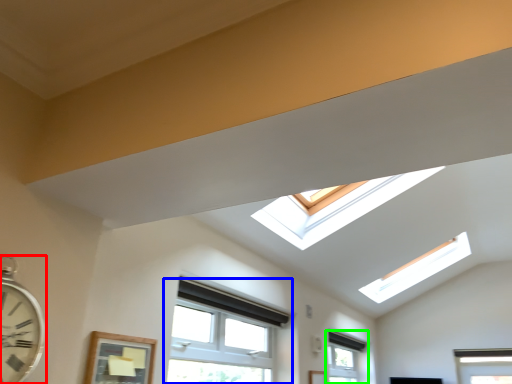
Question: Which is farther away from clock (highlighted by a red box)? window (highlighted by a blue box) or window (highlighted by a green box)?

Choices:
 (A) window
 (B) window

Answer: (B)